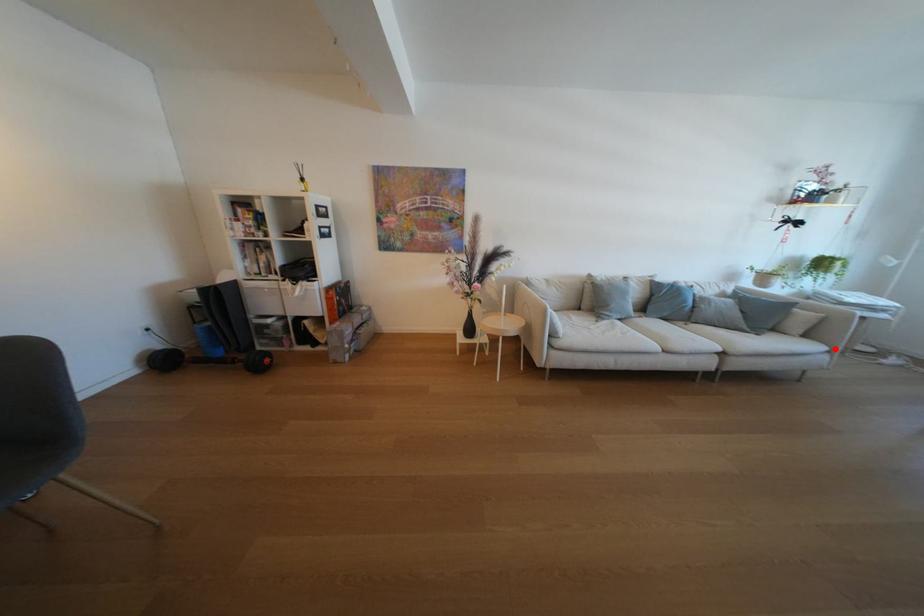
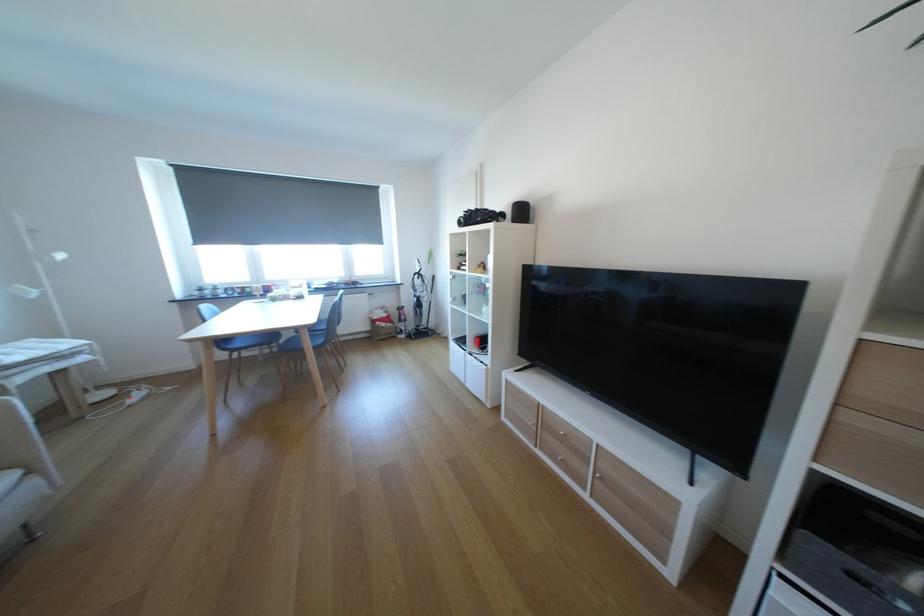
Question: I am providing you with two images of the same scene from different viewpoints. Given a red point in image1, look at the same physical point in image2. Is it:

Choices:
 (A) Closer to the viewpoint
 (B) Farther from the viewpoint

Answer: (B)